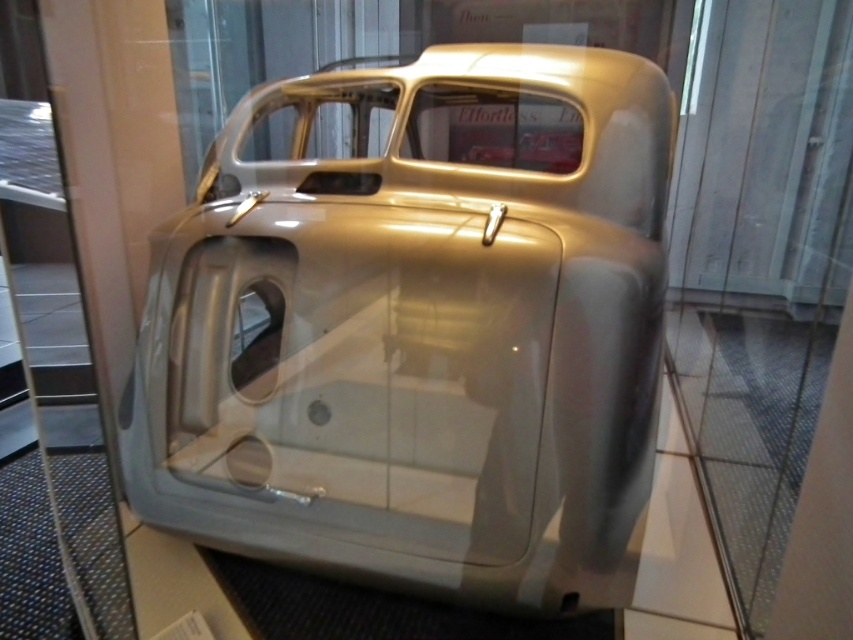
You are standing in a museum and want to take a photo of the metallic silver car at center. The museum requires visitors to stay at least 1 meter away from the display case. If the display case is a rectangle with its corners at coordinates A, B, C, D, and the car is located at point 0.512, 0.490, can you determine if the car is positioned within the display case?

The metallic silver car at center is located at point (416, 326), which is within the display case since the coordinates fall within the rectangle formed by the corners A, B, C, D.